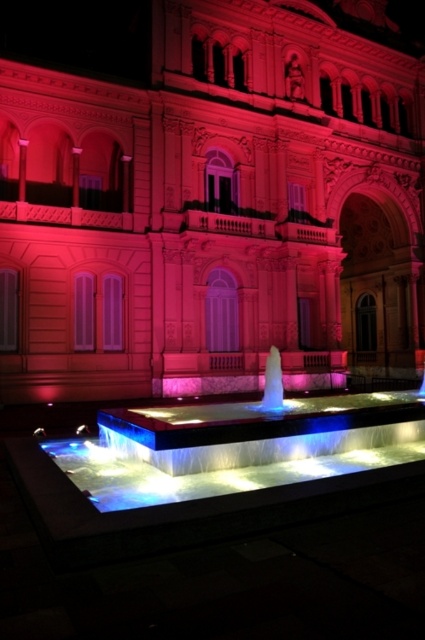
You are an architect evaluating the building and its features. You notice the illuminated glass water feature at center and the illuminated glass fountain at center. Which one has a greater height?

The illuminated glass fountain at center is taller than the illuminated glass water feature at center.

You are an architect evaluating the balance between the matte pink stone palace at center and the illuminated glass fountain at center in the image. Which object occupies more visual space in the composition?

The matte pink stone palace at center has a larger size compared to the illuminated glass fountain at center, so it occupies more visual space in the composition.

You are standing in front of the building and want to take a photo that includes both the matte pink stone palace at center and the illuminated glass fountain at center. Which object should you position closer to the left side of your camera frame?

The matte pink stone palace at center should be positioned closer to the left side of your camera frame because it is located to the left of the illuminated glass fountain at center.